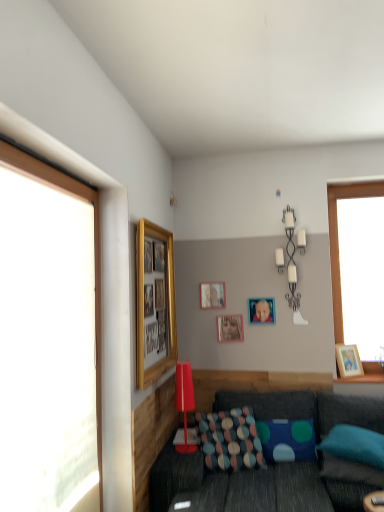
Question: Which direction should I rotate to look at matte red lamp at center, arranged as the 2th lamp when viewed from the right?

Choices:
 (A) left
 (B) right

Answer: (A)

Question: From the image's perspective, does metallic silver candle holder at upper center, which appears as the second lamp when viewed from the front, appear lower than blue fabric pillow at lower right, which is counted as the 3th pillow, starting from the left?

Choices:
 (A) no
 (B) yes

Answer: (A)

Question: From a real-world perspective, is metallic silver candle holder at upper center, which appears as the 1th lamp when viewed from the top, located beneath blue fabric pillow at lower right, the 1th pillow when ordered from right to left?

Choices:
 (A) no
 (B) yes

Answer: (A)

Question: Is metallic silver candle holder at upper center, which is counted as the 2th lamp, starting from the left, at the left side of blue fabric pillow at lower right, which is counted as the 3th pillow, starting from the left?

Choices:
 (A) yes
 (B) no

Answer: (A)

Question: Can you confirm if metallic silver candle holder at upper center, which is counted as the 2th lamp, starting from the left, is taller than blue fabric pillow at lower right, which is counted as the 3th pillow, starting from the left?

Choices:
 (A) no
 (B) yes

Answer: (B)

Question: Is metallic silver candle holder at upper center, which appears as the 1th lamp when viewed from the top, smaller than blue fabric pillow at lower right, the 1th pillow when ordered from right to left?

Choices:
 (A) yes
 (B) no

Answer: (A)

Question: Can you confirm if metallic silver candle holder at upper center, which is the second lamp from bottom to top, is positioned to the right of blue fabric pillow at lower right, which is counted as the 3th pillow, starting from the left?

Choices:
 (A) no
 (B) yes

Answer: (A)

Question: From a real-world perspective, is matte red lamp at center, arranged as the 2th lamp when viewed from the back, below wooden picture frame at right, marked as the second picture frame in a front-to-back arrangement?

Choices:
 (A) no
 (B) yes

Answer: (B)

Question: Considering the relative sizes of matte red lamp at center, arranged as the 1th lamp when viewed from the front, and wooden picture frame at right, marked as the 4th picture frame in a back-to-front arrangement, in the image provided, is matte red lamp at center, arranged as the 1th lamp when viewed from the front, wider than wooden picture frame at right, marked as the 4th picture frame in a back-to-front arrangement,?

Choices:
 (A) no
 (B) yes

Answer: (B)

Question: Is matte red lamp at center, the second lamp in the top-to-bottom sequence, positioned with its back to wooden picture frame at right, marked as the 4th picture frame in a back-to-front arrangement?

Choices:
 (A) yes
 (B) no

Answer: (B)

Question: Does matte red lamp at center, arranged as the 2th lamp when viewed from the back, have a lesser width compared to wooden picture frame at right, marked as the second picture frame in a front-to-back arrangement?

Choices:
 (A) yes
 (B) no

Answer: (B)

Question: Is matte red lamp at center, arranged as the 2th lamp when viewed from the back, directly adjacent to wooden picture frame at right, marked as the second picture frame in a front-to-back arrangement?

Choices:
 (A) yes
 (B) no

Answer: (B)

Question: Does matte red lamp at center, the second lamp in the top-to-bottom sequence, have a smaller size compared to wooden picture frame at right, marked as the 4th picture frame in a back-to-front arrangement?

Choices:
 (A) yes
 (B) no

Answer: (B)

Question: Does gold/glossy picture frame at upper left, arranged as the fifth picture frame when viewed from the right, turn towards textured fabric pillow at lower center, the 1th pillow positioned from the left?

Choices:
 (A) no
 (B) yes

Answer: (A)